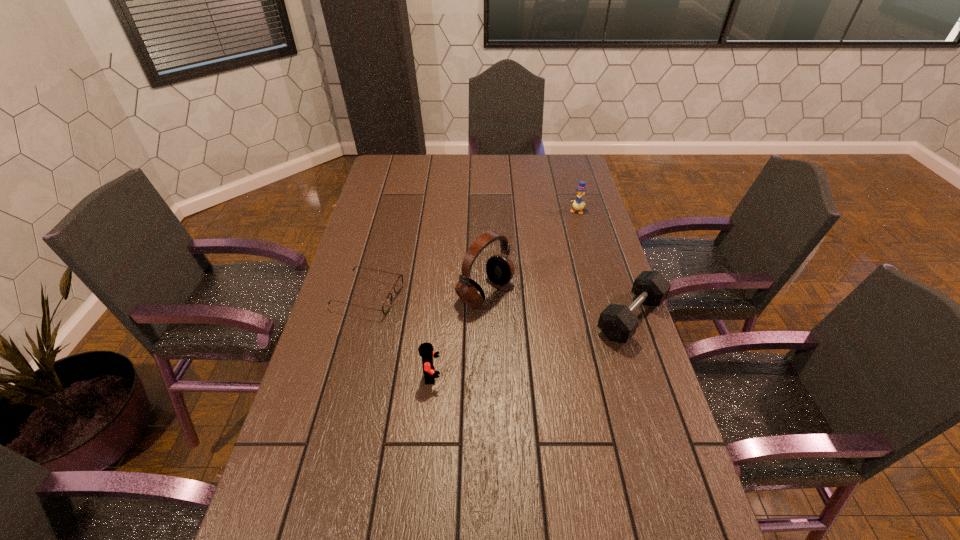
The image size is (960, 540). Identify the location of free space that is in between the dumbbell and the duckling. (604, 265).

At what (x,y) coordinates should I click in order to perform the action: click on empty location between the sunglasses and the fourth object from right to left. Please return your answer as a coordinate pair (x, y). This screenshot has height=540, width=960. Looking at the image, I should click on (400, 335).

The image size is (960, 540). I want to click on empty space that is in between the nearest object and the third object from left to right, so click(x=459, y=334).

You are a GUI agent. You are given a task and a screenshot of the screen. Output one action in this format:
    pyautogui.click(x=<x>, y=<y>)
    Task: Click on the unoccupied area between the fourth object from right to left and the headset
    
    Given the screenshot: What is the action you would take?
    pyautogui.click(x=459, y=334)

Where is `free spot between the second shortest object and the shortest object`? The height and width of the screenshot is (540, 960). free spot between the second shortest object and the shortest object is located at coordinates (499, 307).

Identify which object is located as the fourth nearest to the sunglasses. Please provide its 2D coordinates. Your answer should be formatted as a tuple, i.e. [(x, y)], where the tuple contains the x and y coordinates of a point satisfying the conditions above.

[(578, 204)]

Find the location of a particular element. The width and height of the screenshot is (960, 540). object that is the fourth closest to the leftmost object is located at coordinates (578, 204).

This screenshot has width=960, height=540. What are the coordinates of `vacant region that satisfies the following two spatial constraints: 1. on the back side of the tallest object; 2. on the right side of the duckling` in the screenshot? It's located at (485, 211).

Where is `free point that satisfies the following two spatial constraints: 1. on the front side of the leftmost object; 2. on the right side of the second shortest object`? free point that satisfies the following two spatial constraints: 1. on the front side of the leftmost object; 2. on the right side of the second shortest object is located at coordinates (363, 318).

Locate an element on the screen. vacant space that satisfies the following two spatial constraints: 1. on the front side of the tallest object; 2. on the left side of the dumbbell is located at coordinates [x=486, y=318].